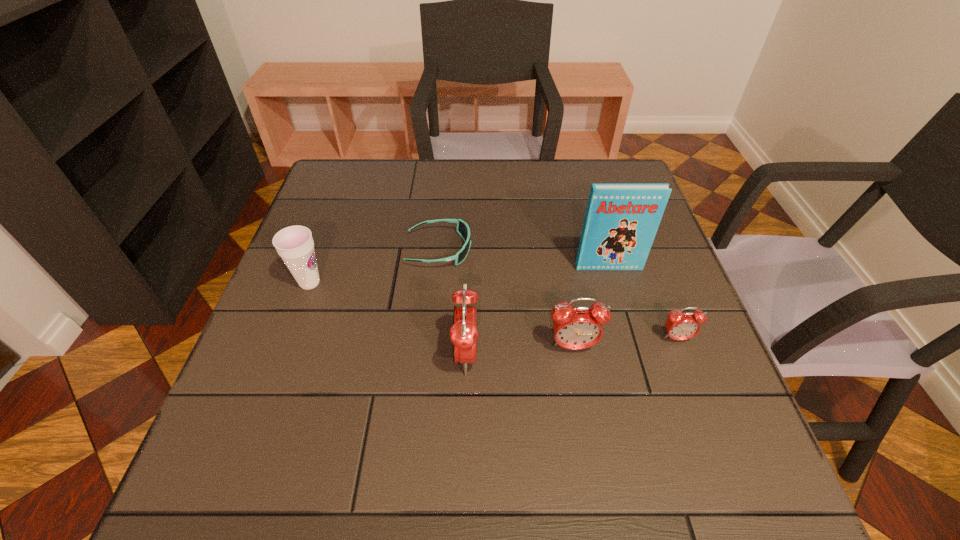
You are a GUI agent. You are given a task and a screenshot of the screen. Output one action in this format:
    pyautogui.click(x=<x>, y=<y>)
    Task: Click on the leftmost alarm clock
    Image resolution: width=960 pixels, height=540 pixels.
    Given the screenshot: What is the action you would take?
    pyautogui.click(x=463, y=334)

Find the location of a particular element. This screenshot has height=540, width=960. the second alarm clock from left to right is located at coordinates (x=575, y=328).

Find the location of `the second shortest object`. the second shortest object is located at coordinates point(680,326).

At what (x,y) coordinates should I click in order to perform the action: click on the rightmost alarm clock. Please return your answer as a coordinate pair (x, y). Looking at the image, I should click on (680, 326).

Identify the location of sunglasses. (463, 229).

The image size is (960, 540). I want to click on cup, so click(295, 245).

In order to click on the tallest object in this screenshot , I will do `click(621, 221)`.

At what (x,y) coordinates should I click in order to perform the action: click on free space located on the face of the leftmost alarm clock. Please return your answer as a coordinate pair (x, y). This screenshot has width=960, height=540. Looking at the image, I should click on (534, 355).

What are the coordinates of `vacant space located 0.080m on the face of the second alarm clock from right to left` in the screenshot? It's located at (581, 392).

Locate an element on the screen. This screenshot has height=540, width=960. free space located 0.130m on the face of the fifth tallest object is located at coordinates (701, 402).